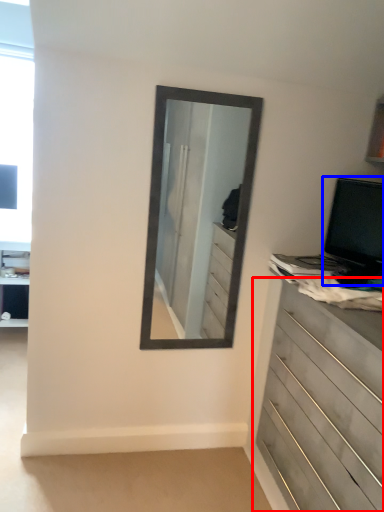
Question: Among these objects, which one is farthest to the camera, chest of drawers (highlighted by a red box) or computer monitor (highlighted by a blue box)?

Choices:
 (A) chest of drawers
 (B) computer monitor

Answer: (B)